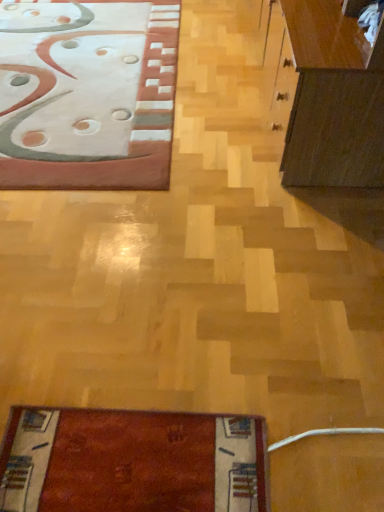
What do you see at coordinates (333, 99) in the screenshot? I see `dark brown wood cabinet at right` at bounding box center [333, 99].

Where is `dark brown wood cabinet at right`? The width and height of the screenshot is (384, 512). dark brown wood cabinet at right is located at coordinates (333, 99).

What do you see at coordinates (87, 94) in the screenshot?
I see `matte pink rug at upper left` at bounding box center [87, 94].

Where is `matte pink rug at upper left`? This screenshot has height=512, width=384. matte pink rug at upper left is located at coordinates (87, 94).

Find the location of a particular element. dark brown wood cabinet at right is located at coordinates (x=333, y=99).

Which object is positioned more to the right, matte pink rug at upper left or dark brown wood cabinet at right?

From the viewer's perspective, dark brown wood cabinet at right appears more on the right side.

Which object is further away from the camera taking this photo, matte pink rug at upper left or dark brown wood cabinet at right?

matte pink rug at upper left is behind.

Is point (7, 25) closer or farther from the camera than point (314, 54)?

Point (7, 25) appears to be farther away from the viewer than point (314, 54).

From the image's perspective, which is below, matte pink rug at upper left or dark brown wood cabinet at right?

From the image's view, dark brown wood cabinet at right is below.

From a real-world perspective, who is located higher, matte pink rug at upper left or dark brown wood cabinet at right?

In real-world perspective, dark brown wood cabinet at right is above.

Can you confirm if matte pink rug at upper left is thinner than dark brown wood cabinet at right?

In fact, matte pink rug at upper left might be wider than dark brown wood cabinet at right.

Is matte pink rug at upper left taller or shorter than dark brown wood cabinet at right?

Clearly, matte pink rug at upper left is shorter compared to dark brown wood cabinet at right.

Is matte pink rug at upper left bigger than dark brown wood cabinet at right?

No.

Choose the correct answer: Is matte pink rug at upper left inside dark brown wood cabinet at right or outside it?

matte pink rug at upper left is spatially situated outside dark brown wood cabinet at right.

Is matte pink rug at upper left far away from dark brown wood cabinet at right?

That's right, there is a large distance between matte pink rug at upper left and dark brown wood cabinet at right.

Is matte pink rug at upper left facing away from dark brown wood cabinet at right?

No.

In order to click on furniture on the left side of dark brown wood cabinet at right in this screenshot , I will do 87,94.

Visually, is dark brown wood cabinet at right positioned to the left or to the right of matte pink rug at upper left?

dark brown wood cabinet at right is positioned on matte pink rug at upper left's right side.

Considering their positions, is dark brown wood cabinet at right located in front of or behind matte pink rug at upper left?

dark brown wood cabinet at right is positioned closer to the viewer than matte pink rug at upper left.

Considering the points (332, 128) and (70, 140), which point is behind, point (332, 128) or point (70, 140)?

The point (70, 140) is farther from the camera.

From the image's perspective, who appears lower, dark brown wood cabinet at right or matte pink rug at upper left?

dark brown wood cabinet at right, from the image's perspective.

From a real-world perspective, is dark brown wood cabinet at right physically below matte pink rug at upper left?

No, from a real-world perspective, dark brown wood cabinet at right is not beneath matte pink rug at upper left.

In terms of width, does dark brown wood cabinet at right look wider or thinner when compared to matte pink rug at upper left?

Considering their sizes, dark brown wood cabinet at right looks slimmer than matte pink rug at upper left.

Consider the image. Which of these two, dark brown wood cabinet at right or matte pink rug at upper left, stands shorter?

matte pink rug at upper left is shorter.

Based on their sizes in the image, would you say dark brown wood cabinet at right is bigger or smaller than matte pink rug at upper left?

dark brown wood cabinet at right is bigger than matte pink rug at upper left.

Could matte pink rug at upper left be considered to be inside dark brown wood cabinet at right?

Definitely not — matte pink rug at upper left is not inside dark brown wood cabinet at right.

Are dark brown wood cabinet at right and matte pink rug at upper left far apart?

dark brown wood cabinet at right is far away from matte pink rug at upper left.

Is dark brown wood cabinet at right aimed at matte pink rug at upper left?

No.

What's the angular difference between dark brown wood cabinet at right and matte pink rug at upper left's facing directions?

The angular difference between dark brown wood cabinet at right and matte pink rug at upper left is 1.48 degrees.

Find the location of a particular element. The height and width of the screenshot is (512, 384). furniture below the dark brown wood cabinet at right (from a real-world perspective) is located at coordinates (87, 94).

This screenshot has height=512, width=384. I want to click on cabinetry located in front of the matte pink rug at upper left, so click(333, 99).

In the image, there is a dark brown wood cabinet at right. Identify the location of furniture above it (from the image's perspective). Image resolution: width=384 pixels, height=512 pixels. (87, 94).